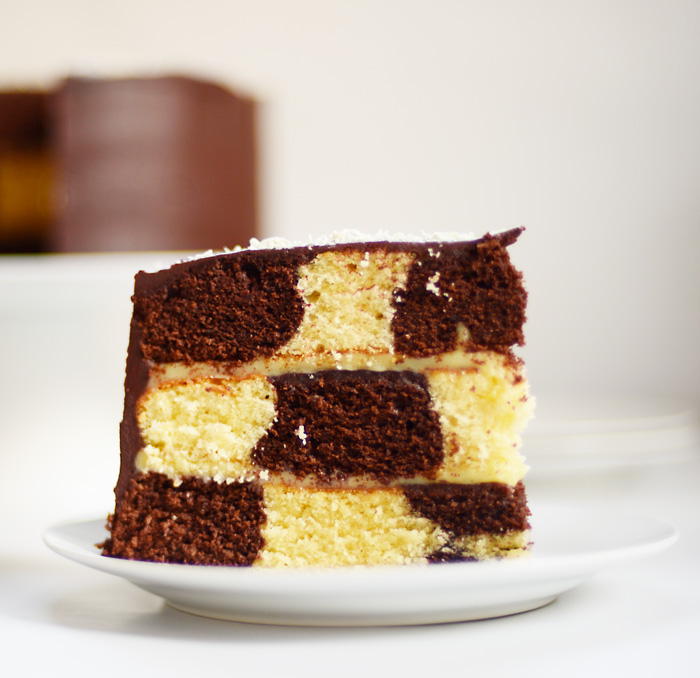
Where is `left edge of plate`? left edge of plate is located at coordinates coord(43,540).